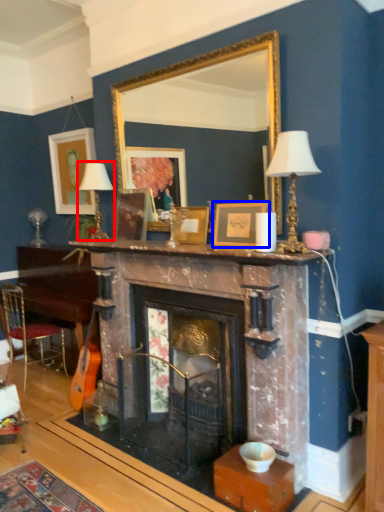
Question: Which point is closer to the camera, table lamp (highlighted by a red box) or picture frame (highlighted by a blue box)?

Choices:
 (A) table lamp
 (B) picture frame

Answer: (B)